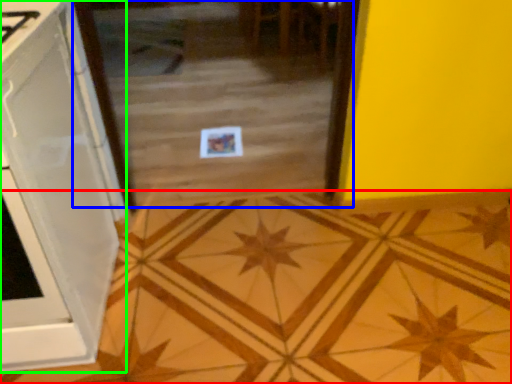
Question: Which is farther away from ceramic tile (highlighted by a red box)? glass door (highlighted by a blue box) or cabinetry (highlighted by a green box)?

Choices:
 (A) glass door
 (B) cabinetry

Answer: (A)